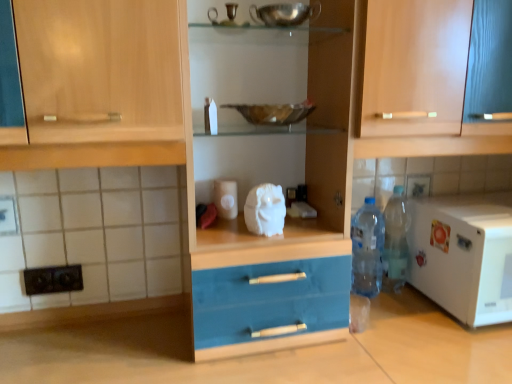
Question: Can you confirm if metallic reflective bowl at center is shorter than wooden cabinet at upper center?

Choices:
 (A) no
 (B) yes

Answer: (B)

Question: Is metallic reflective bowl at center completely or partially outside of wooden cabinet at upper center?

Choices:
 (A) no
 (B) yes

Answer: (B)

Question: From the image's perspective, is metallic reflective bowl at center under wooden cabinet at upper center?

Choices:
 (A) yes
 (B) no

Answer: (A)

Question: Is metallic reflective bowl at center oriented towards wooden cabinet at upper center?

Choices:
 (A) yes
 (B) no

Answer: (B)

Question: Is the depth of metallic reflective bowl at center less than that of wooden cabinet at upper center?

Choices:
 (A) no
 (B) yes

Answer: (A)

Question: In terms of width, does metallic reflective bowl at center look wider or thinner when compared to translucent plastic bottle at lower right, which is counted as the first bottle, starting from the right?

Choices:
 (A) wide
 (B) thin

Answer: (A)

Question: From the image's perspective, is metallic reflective bowl at center above or below translucent plastic bottle at lower right, which is counted as the first bottle, starting from the right?

Choices:
 (A) above
 (B) below

Answer: (A)

Question: From a real-world perspective, is metallic reflective bowl at center positioned above or below translucent plastic bottle at lower right, which is counted as the first bottle, starting from the right?

Choices:
 (A) above
 (B) below

Answer: (A)

Question: Is point pos(306,110) closer or farther from the camera than point pos(385,283)?

Choices:
 (A) farther
 (B) closer

Answer: (B)

Question: From a real-world perspective, relative to translucent plastic bottle at lower right, which is counted as the first bottle, starting from the right, is matte wood cabinet at center vertically above or below?

Choices:
 (A) above
 (B) below

Answer: (A)

Question: Relative to translucent plastic bottle at lower right, which is counted as the first bottle, starting from the right, is matte wood cabinet at center in front or behind?

Choices:
 (A) behind
 (B) front

Answer: (B)

Question: Is matte wood cabinet at center inside the boundaries of translucent plastic bottle at lower right, which is counted as the first bottle, starting from the right, or outside?

Choices:
 (A) outside
 (B) inside

Answer: (A)

Question: From the image's perspective, is matte wood cabinet at center above or below translucent plastic bottle at lower right, the 2th bottle viewed from the left?

Choices:
 (A) below
 (B) above

Answer: (B)

Question: Is point (415, 182) closer or farther from the camera than point (436, 221)?

Choices:
 (A) farther
 (B) closer

Answer: (A)

Question: Is white glossy tile at upper center inside the boundaries of white matte microwave at right, or outside?

Choices:
 (A) outside
 (B) inside

Answer: (A)